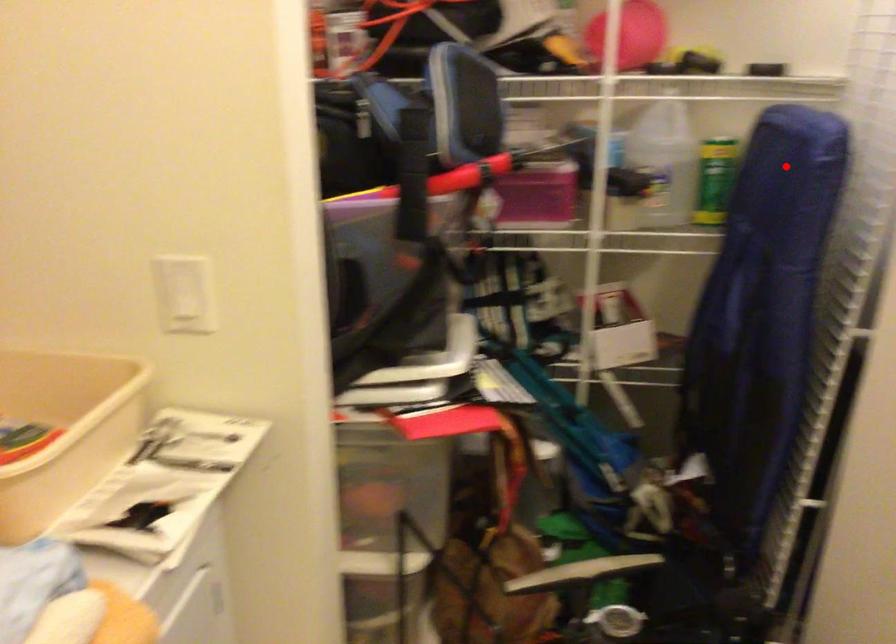
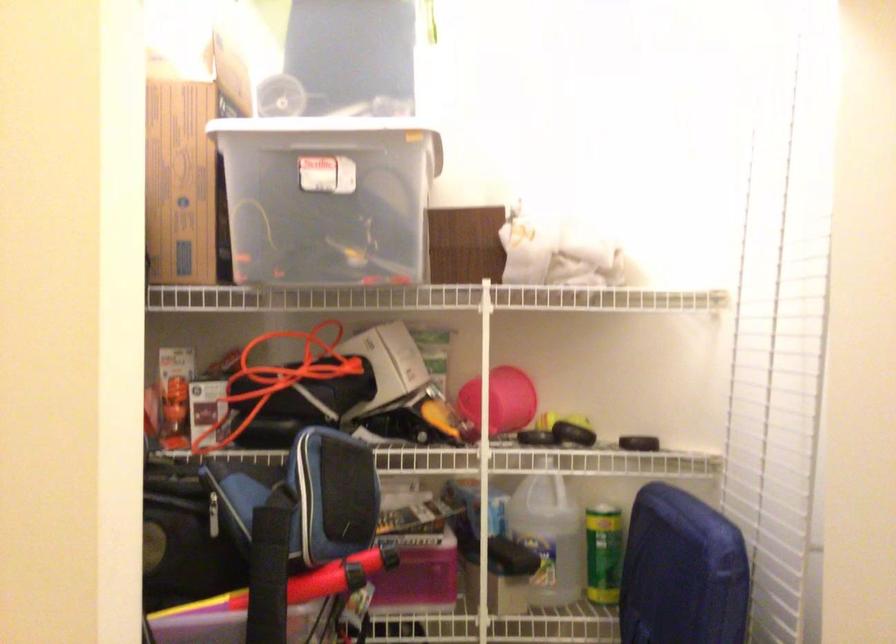
Where in the second image is the point corresponding to the highlighted location from the first image?

(682, 572)